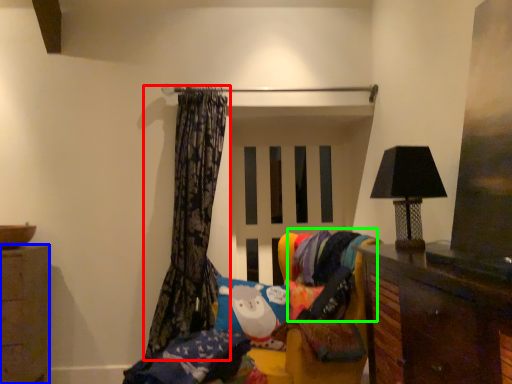
Question: Which object is the farthest from curtain (highlighted by a red box)? Choose among these: cabinetry (highlighted by a blue box) or fabric (highlighted by a green box).

Choices:
 (A) cabinetry
 (B) fabric

Answer: (A)